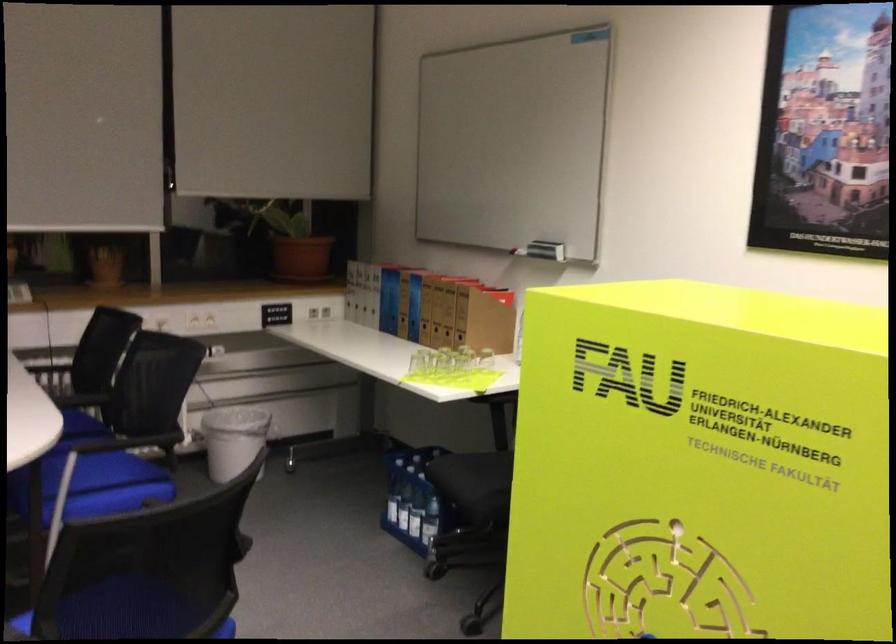
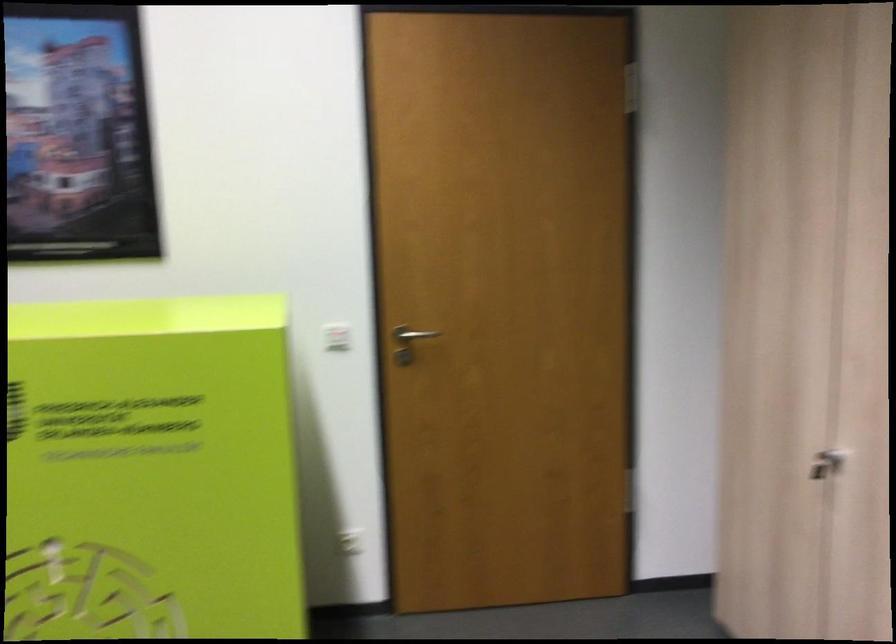
Question: How did the camera likely rotate?

Choices:
 (A) Left
 (B) Right
 (C) Up
 (D) Down

Answer: (B)